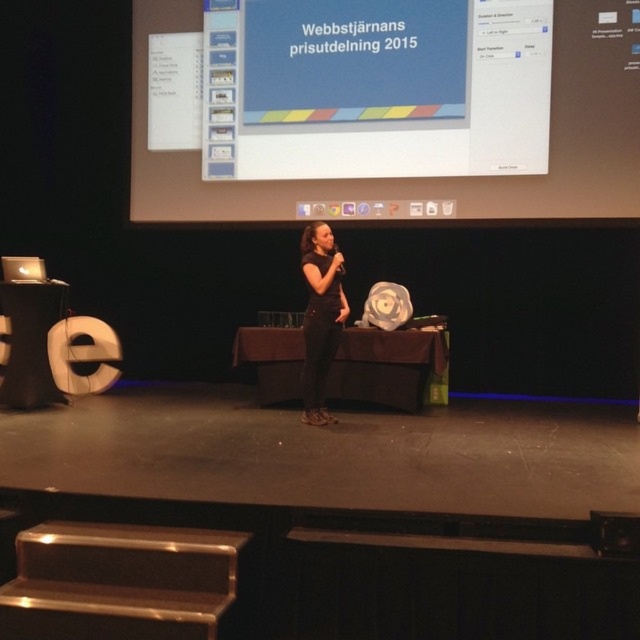
Question: Which point appears closest to the camera in this image?

Choices:
 (A) coord(321,232)
 (B) coord(212,182)

Answer: (A)

Question: Does white glossy projection screen at upper center have a larger size compared to black matte dress at center?

Choices:
 (A) no
 (B) yes

Answer: (A)

Question: Can you confirm if white glossy projection screen at upper center is bigger than black matte dress at center?

Choices:
 (A) yes
 (B) no

Answer: (B)

Question: Is white glossy projection screen at upper center in front of black matte dress at center?

Choices:
 (A) yes
 (B) no

Answer: (B)